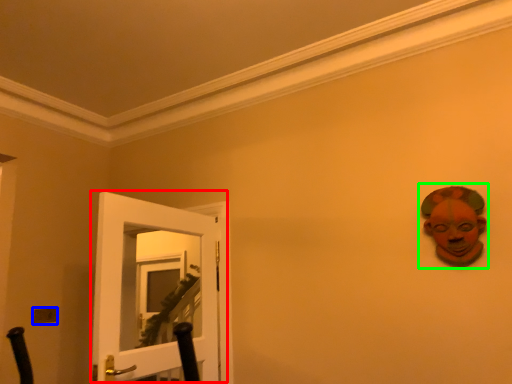
Question: Which is farther away from door (highlighted by a red box)? light switch (highlighted by a blue box) or person (highlighted by a green box)?

Choices:
 (A) light switch
 (B) person

Answer: (B)